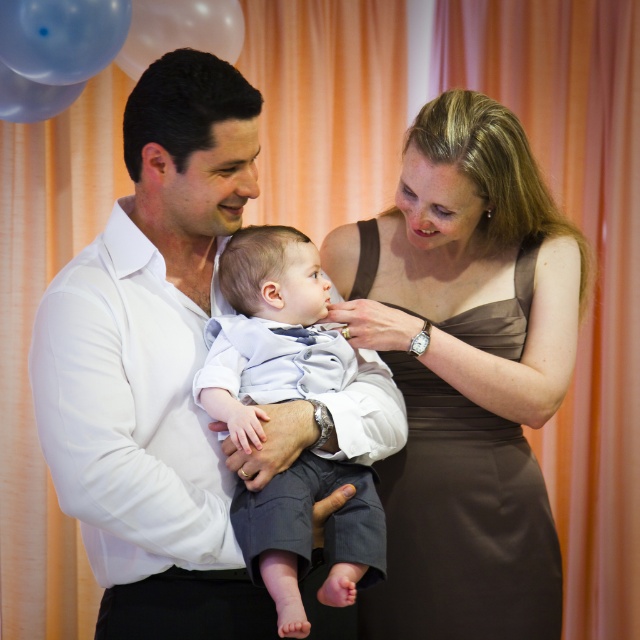
You are a photographer standing in front of the family. You notice a point at coordinate (61, 36) in the image. What object is located at that point?

The point at coordinate (61, 36) indicates a transparent plastic balloon at upper left.

You are a photographer setting up for a family portrait. You notice two balloons in the upper left corner of the scene. To ensure they are both in focus, you need to know how far apart they are. Can you determine the distance between the transparent plastic balloon at upper left and the translucent blue balloon at upper left?

The distance between the transparent plastic balloon at upper left and the translucent blue balloon at upper left is 9.33 inches, so you can adjust your camera settings to capture both balloons in focus at that distance.

You are a photographer trying to capture the perfect shot of the family. You notice two points in the image at coordinates point (220, 356) and point (86, 38). Which of these points is positioned closer to you?

Point (220, 356) is closer to the viewer than point (86, 38).